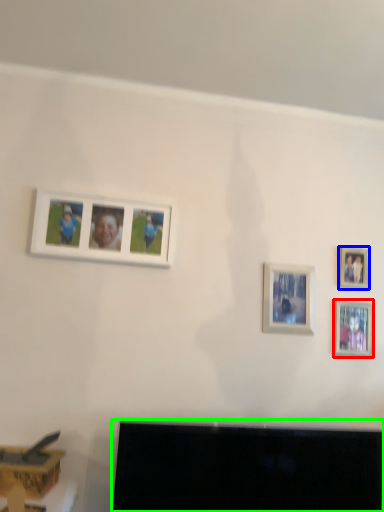
Question: Based on their relative distances, which object is nearer to picture frame (highlighted by a red box)? Choose from picture frame (highlighted by a blue box) and television (highlighted by a green box).

Choices:
 (A) picture frame
 (B) television

Answer: (A)